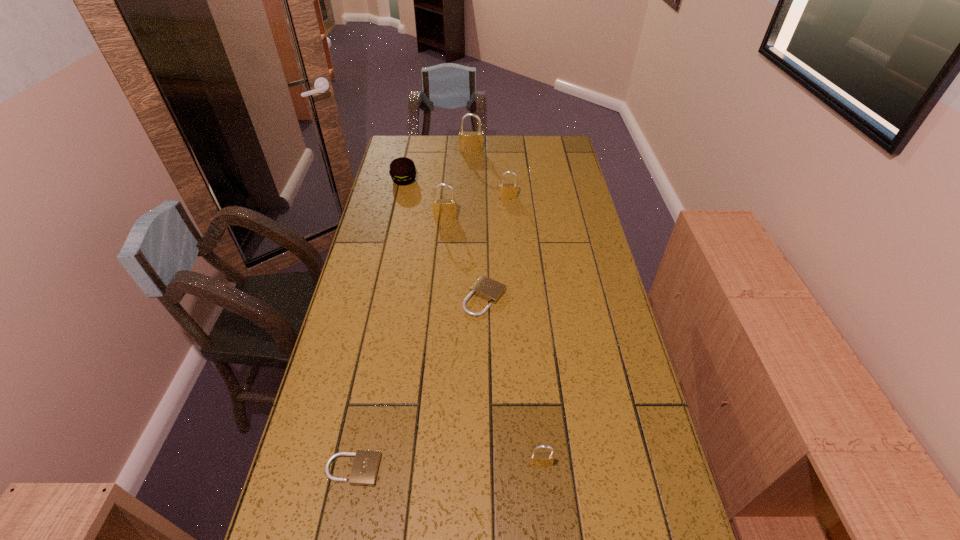
The width and height of the screenshot is (960, 540). In order to click on the fifth farthest object in this screenshot , I will do `click(486, 288)`.

Locate an element on the screen. the shortest object is located at coordinates click(365, 467).

Locate an element on the screen. The image size is (960, 540). the smaller beige padlock is located at coordinates (365, 467).

You are a GUI agent. You are given a task and a screenshot of the screen. Output one action in this format:
    pyautogui.click(x=<x>, y=<y>)
    Task: Click on the free spot located 0.280m on the front-facing side of the farthest padlock
    
    Given the screenshot: What is the action you would take?
    pyautogui.click(x=470, y=187)

Locate an element on the screen. free location located on the front-facing side of the third smallest brass padlock is located at coordinates (438, 298).

This screenshot has height=540, width=960. What are the coordinates of `free point located 0.050m on the front-facing side of the second smallest brass padlock` in the screenshot? It's located at (509, 207).

The width and height of the screenshot is (960, 540). I want to click on vacant position located on the front of the second farthest object, so pos(400,199).

Find the location of a particular element. This screenshot has width=960, height=540. free region located 0.050m on the front-facing side of the smallest brass padlock is located at coordinates (543, 490).

Where is `blank area located on the left of the second shortest padlock`? This screenshot has height=540, width=960. blank area located on the left of the second shortest padlock is located at coordinates (421, 298).

Where is `vacant area located on the right of the nearer beige padlock`? The height and width of the screenshot is (540, 960). vacant area located on the right of the nearer beige padlock is located at coordinates (449, 469).